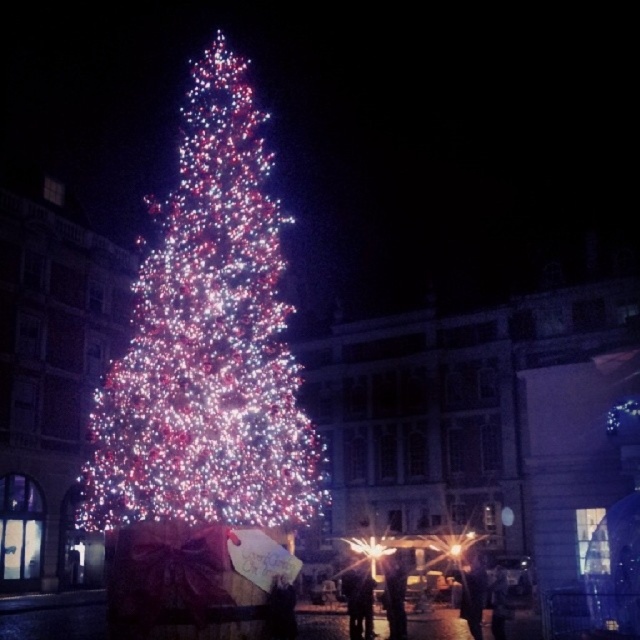
Does dark fabric coat at lower center come in front of dark fabric coat at lower right?

That is False.

Between dark fabric coat at lower center and dark fabric coat at lower right, which one is positioned lower?

dark fabric coat at lower center is lower down.

The width and height of the screenshot is (640, 640). Identify the location of dark fabric coat at lower center. (358, 600).

Who is taller, illuminated plastic christmas tree at center or dark fabric coat at lower center?

With more height is illuminated plastic christmas tree at center.

Is illuminated plastic christmas tree at center behind dark fabric coat at lower center?

No.

Identify the location of illuminated plastic christmas tree at center. (208, 342).

In order to click on illuminated plastic christmas tree at center in this screenshot , I will do `click(208, 342)`.

Which of these two, dark fabric coat at lower center or denim pants at center, stands taller?

dark fabric coat at lower center is taller.

Measure the distance between point (360, 636) and camera.

They are 52.98 meters apart.

You are a GUI agent. You are given a task and a screenshot of the screen. Output one action in this format:
    pyautogui.click(x=<x>, y=<y>)
    Task: Click on the dark fabric coat at lower center
    This screenshot has width=640, height=640.
    Given the screenshot: What is the action you would take?
    pyautogui.click(x=358, y=600)